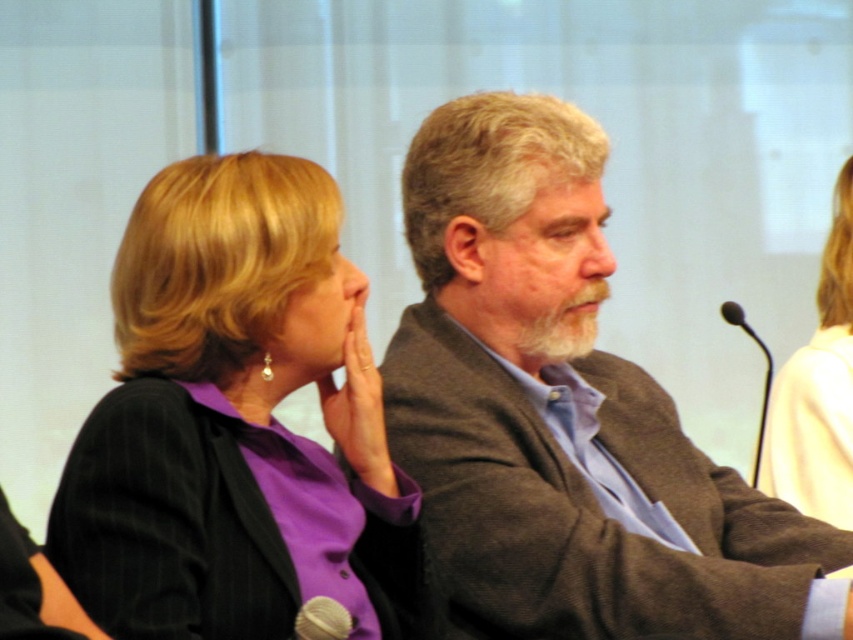
Is point (834, 566) positioned in front of point (764, 394)?

Yes, point (834, 566) is closer to viewer.

Looking at this image, which is below, brown woolen jacket at center or black metallic microphone at right?

black metallic microphone at right is lower down.

Locate an element on the screen. The image size is (853, 640). brown woolen jacket at center is located at coordinates (566, 413).

Find the location of a particular element. The width and height of the screenshot is (853, 640). brown woolen jacket at center is located at coordinates (566, 413).

Does brown woolen jacket at center appear on the left side of silver metallic microphone at lower left?

Incorrect, brown woolen jacket at center is not on the left side of silver metallic microphone at lower left.

Is brown woolen jacket at center wider than silver metallic microphone at lower left?

Yes.

Image resolution: width=853 pixels, height=640 pixels. What do you see at coordinates (566, 413) in the screenshot?
I see `brown woolen jacket at center` at bounding box center [566, 413].

The image size is (853, 640). Identify the location of brown woolen jacket at center. (566, 413).

Does purple matte blazer at center come in front of black metallic microphone at right?

Yes.

Is point (363, 364) more distant than point (767, 355)?

That is False.

Which is in front, point (292, 200) or point (769, 371)?

Point (292, 200)

Locate an element on the screen. This screenshot has width=853, height=640. purple matte blazer at center is located at coordinates (235, 422).